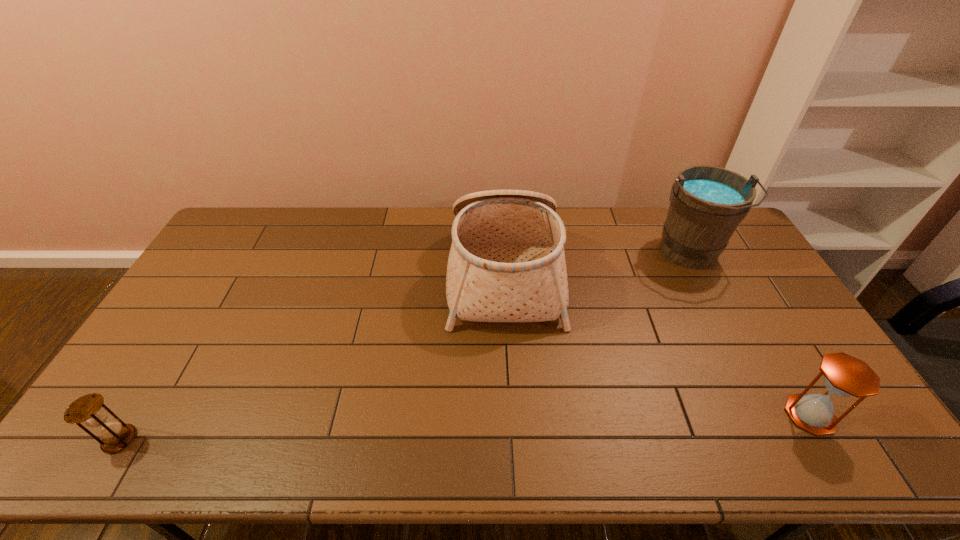
This screenshot has height=540, width=960. Find the location of `wine bucket`. wine bucket is located at coordinates (707, 203).

Image resolution: width=960 pixels, height=540 pixels. What are the coordinates of `the third object from right to left` in the screenshot? It's located at (507, 263).

Where is `the third tallest object`? This screenshot has width=960, height=540. the third tallest object is located at coordinates (844, 375).

At what (x,y) coordinates should I click in order to perform the action: click on the taller hourglass. Please return your answer as a coordinate pair (x, y). Image resolution: width=960 pixels, height=540 pixels. Looking at the image, I should click on (844, 375).

Where is `the shorter hourglass`? The image size is (960, 540). the shorter hourglass is located at coordinates (90, 409).

Locate an element on the screen. The width and height of the screenshot is (960, 540). the left hourglass is located at coordinates (90, 409).

This screenshot has height=540, width=960. I want to click on free point located with a handle on the side of the wine bucket, so 734,342.

Where is `vacant space positioned with the lid open on the second object from left to right`? The height and width of the screenshot is (540, 960). vacant space positioned with the lid open on the second object from left to right is located at coordinates (431, 272).

Find the location of a particular element. The image size is (960, 540). free space located 0.120m with the lid open on the second object from left to right is located at coordinates (413, 272).

You are a GUI agent. You are given a task and a screenshot of the screen. Output one action in this format:
    pyautogui.click(x=<x>, y=<y>)
    Task: Click on the free space located 0.360m with the lid open on the second object from left to right
    The image size is (960, 540).
    Given the screenshot: What is the action you would take?
    pyautogui.click(x=342, y=272)